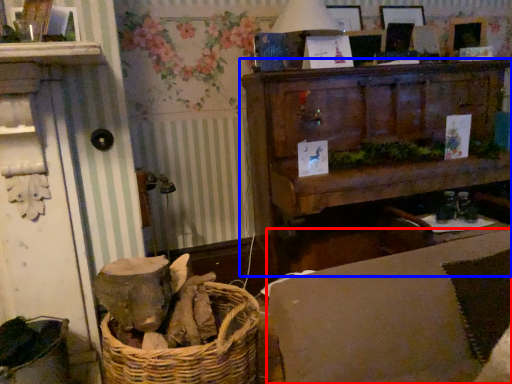
Question: Which point is further to the camera, couch (highlighted by a red box) or furniture (highlighted by a blue box)?

Choices:
 (A) couch
 (B) furniture

Answer: (B)